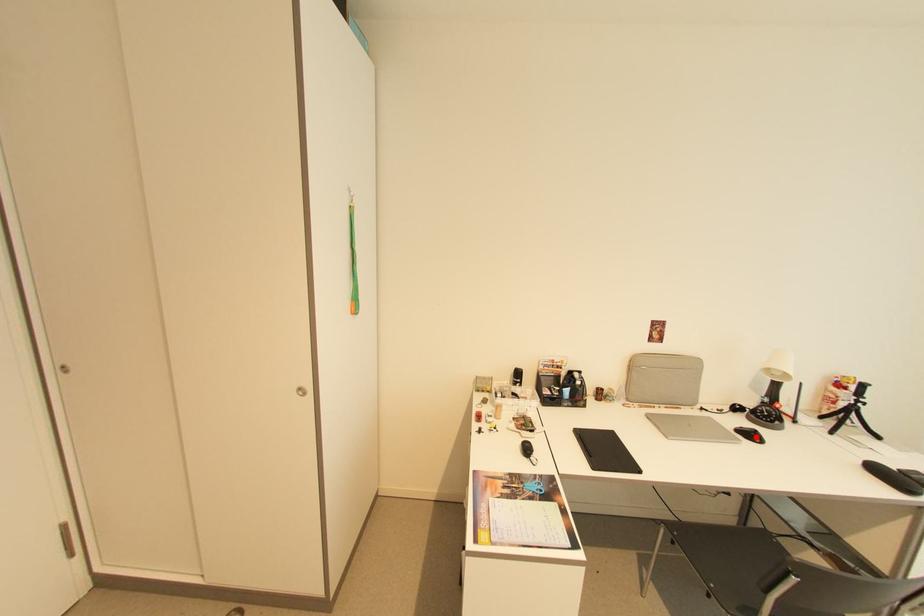
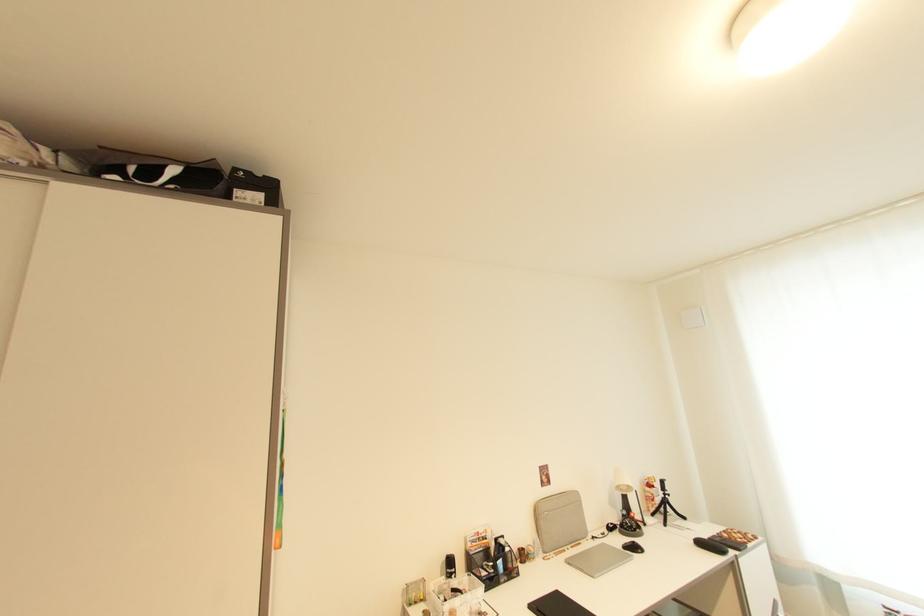
The point at the highlighted location is marked in the first image. Where is the corresponding point in the second image?

(639, 549)